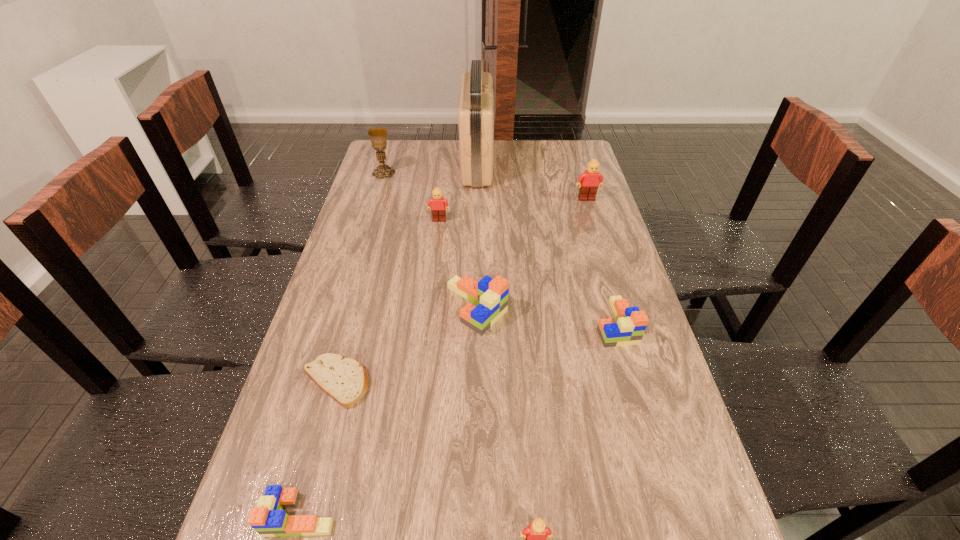
Find the location of a particular element. The image size is (960, 540). the shortest Lego is located at coordinates (268, 519).

Locate an element on the screen. pita bread is located at coordinates (345, 380).

Locate an element on the screen. the shortest object is located at coordinates (345, 380).

Identify the location of vacant area situated on the front-facing side of the beige radio receiver. (513, 163).

At what (x,y) coordinates should I click in order to perform the action: click on vacant space located on the right of the gold chalice. Please return your answer as a coordinate pair (x, y). The width and height of the screenshot is (960, 540). Looking at the image, I should click on (451, 173).

Locate an element on the screen. The width and height of the screenshot is (960, 540). free point located 0.360m on the face of the farthest Lego is located at coordinates (610, 274).

Find the location of `free space located 0.110m on the face of the fourth object from left to right`. free space located 0.110m on the face of the fourth object from left to right is located at coordinates (437, 244).

You are a GUI agent. You are given a task and a screenshot of the screen. Output one action in this format:
    pyautogui.click(x=<x>, y=<y>)
    Task: Click on the free spot located 0.060m on the back of the second orange Lego from right to left
    The width and height of the screenshot is (960, 540).
    Given the screenshot: What is the action you would take?
    pyautogui.click(x=477, y=266)

Locate an element on the screen. The width and height of the screenshot is (960, 540). free space located 0.320m on the left of the rightmost orange Lego is located at coordinates [x=470, y=323].

Locate an element on the screen. vacant space positioned 0.360m on the right of the nearest orange Lego is located at coordinates (532, 515).